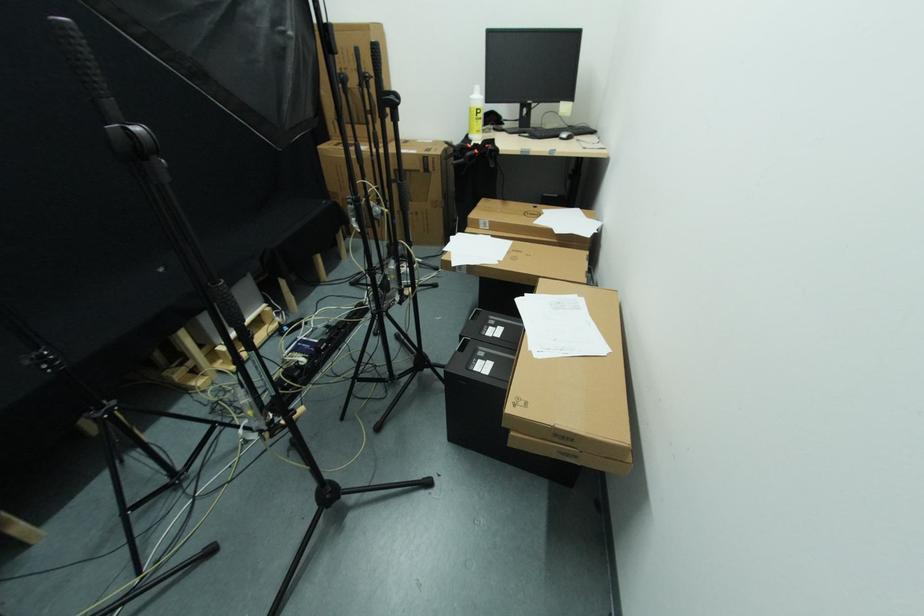
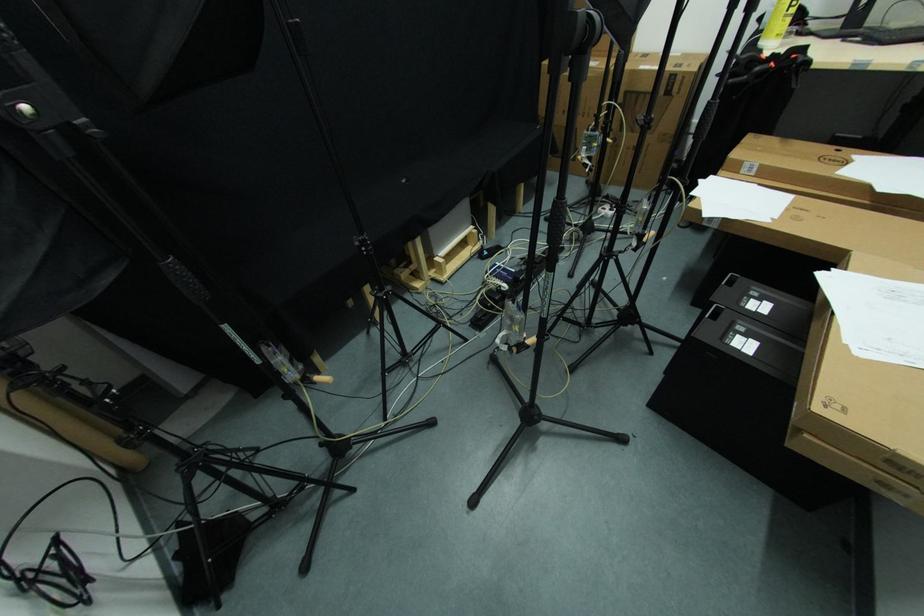
Find the pixel in the second image that matches pixel 432 161 in the first image.

(679, 81)